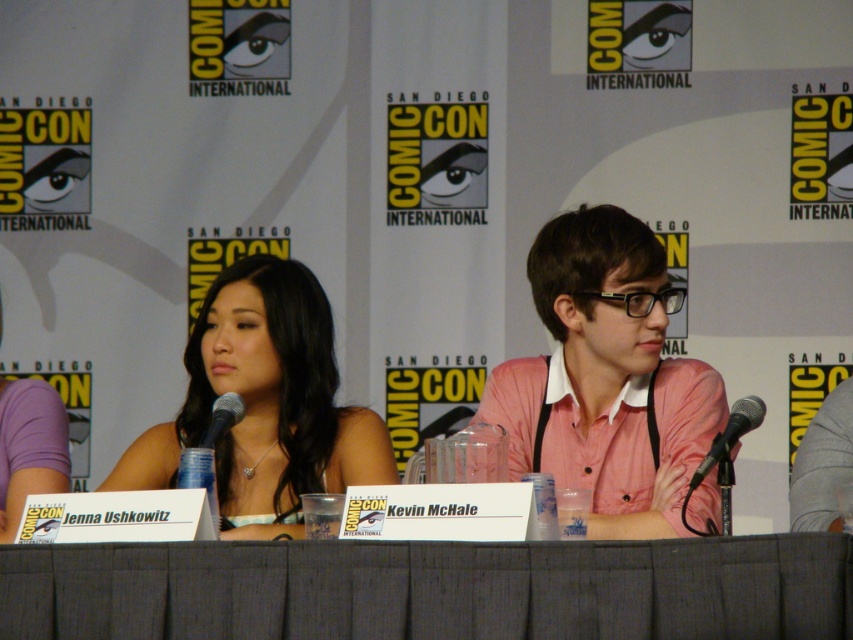
Between pink cotton shirt at center and matte black dress at center, which one appears on the left side from the viewer's perspective?

Positioned to the left is matte black dress at center.

Is pink cotton shirt at center taller than matte black dress at center?

Yes, pink cotton shirt at center is taller than matte black dress at center.

In order to click on pink cotton shirt at center in this screenshot , I will do `click(607, 378)`.

From the picture: Can you confirm if matte black dress at center is positioned to the left of black metallic microphone at center?

Yes, matte black dress at center is to the left of black metallic microphone at center.

Does matte black dress at center have a lesser height compared to black metallic microphone at center?

Incorrect, matte black dress at center's height does not fall short of black metallic microphone at center's.

Does point (218, 486) come in front of point (700, 468)?

No, (218, 486) is behind (700, 468).

Where is `matte black dress at center`? The image size is (853, 640). matte black dress at center is located at coordinates (264, 404).

Is pink cotton shirt at center positioned at the back of black matte microphone at center?

Yes.

Does pink cotton shirt at center have a lesser height compared to black matte microphone at center?

Incorrect, pink cotton shirt at center's height does not fall short of black matte microphone at center's.

Locate an element on the screen. This screenshot has height=640, width=853. pink cotton shirt at center is located at coordinates (607, 378).